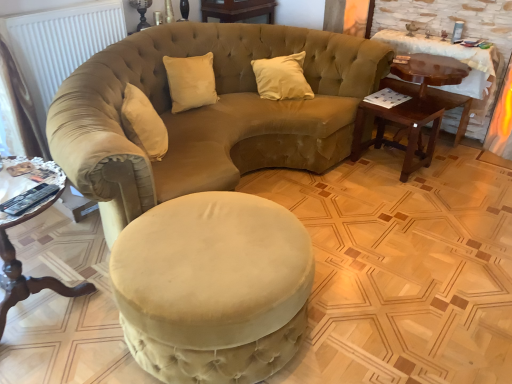
Question: Is velvet beige studio couch at center bigger than dark brown wood side table at right, which appears as the 2th table when viewed from the right?

Choices:
 (A) yes
 (B) no

Answer: (A)

Question: Is velvet beige studio couch at center positioned beyond the bounds of dark brown wood side table at right, which appears as the 2th table when viewed from the right?

Choices:
 (A) yes
 (B) no

Answer: (A)

Question: Is velvet beige studio couch at center behind dark brown wood side table at right, which appears as the 2th table when viewed from the back?

Choices:
 (A) no
 (B) yes

Answer: (A)

Question: From the image's perspective, is velvet beige studio couch at center under dark brown wood side table at right, the second table in the left-to-right sequence?

Choices:
 (A) no
 (B) yes

Answer: (A)

Question: Can you confirm if velvet beige studio couch at center is positioned to the right of dark brown wood side table at right, the 2th table when ordered from front to back?

Choices:
 (A) no
 (B) yes

Answer: (A)

Question: Does velvet beige studio couch at center appear on the left side of dark brown wood side table at right, the second table in the left-to-right sequence?

Choices:
 (A) yes
 (B) no

Answer: (A)

Question: Is dark brown wood side table at right, which appears as the 2th table when viewed from the right, at the left side of wooden round table at lower left, which ranks as the 3th table in right-to-left order?

Choices:
 (A) yes
 (B) no

Answer: (B)

Question: Is dark brown wood side table at right, the 2th table when ordered from front to back, oriented away from wooden round table at lower left, the 3th table from the back?

Choices:
 (A) no
 (B) yes

Answer: (A)

Question: Is dark brown wood side table at right, which appears as the 2th table when viewed from the right, not close to wooden round table at lower left, the 1th table when ordered from left to right?

Choices:
 (A) yes
 (B) no

Answer: (A)

Question: Considering the relative sizes of dark brown wood side table at right, the 2th table when ordered from front to back, and wooden round table at lower left, the 3th table from the back, in the image provided, is dark brown wood side table at right, the 2th table when ordered from front to back, bigger than wooden round table at lower left, the 3th table from the back,?

Choices:
 (A) yes
 (B) no

Answer: (B)

Question: Considering the relative positions of dark brown wood side table at right, the second table in the left-to-right sequence, and wooden round table at lower left, which appears as the 1th table when viewed from the front, in the image provided, is dark brown wood side table at right, the second table in the left-to-right sequence, to the right of wooden round table at lower left, which appears as the 1th table when viewed from the front, from the viewer's perspective?

Choices:
 (A) yes
 (B) no

Answer: (A)

Question: Is dark brown wood side table at right, which appears as the 2th table when viewed from the right, wider than wooden round table at lower left, which ranks as the 3th table in right-to-left order?

Choices:
 (A) yes
 (B) no

Answer: (B)

Question: From a real-world perspective, is mahogany wood side table at right, the 1th table positioned from the back, below beige velvet pillow at center?

Choices:
 (A) no
 (B) yes

Answer: (B)